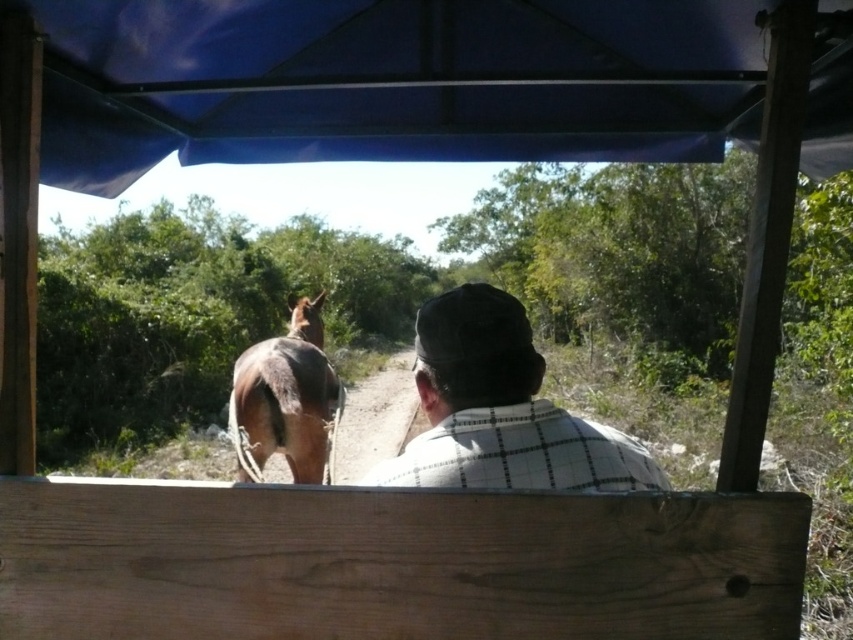
Question: Which point appears farthest from the camera in this image?

Choices:
 (A) (57, 17)
 (B) (283, 394)

Answer: (B)

Question: Which object is the closest to the brown glossy horse at center?

Choices:
 (A) white checkered shirt at center
 (B) blue fabric canopy at upper center

Answer: (B)

Question: Considering the relative positions of blue fabric canopy at upper center and white checkered shirt at center in the image provided, where is blue fabric canopy at upper center located with respect to white checkered shirt at center?

Choices:
 (A) below
 (B) above

Answer: (B)

Question: Considering the relative positions of white checkered shirt at center and brown glossy horse at center in the image provided, where is white checkered shirt at center located with respect to brown glossy horse at center?

Choices:
 (A) left
 (B) right

Answer: (B)

Question: Which object is closer to the camera taking this photo?

Choices:
 (A) blue fabric canopy at upper center
 (B) white checkered shirt at center
 (C) brown glossy horse at center

Answer: (B)

Question: From the image, what is the correct spatial relationship of blue fabric canopy at upper center in relation to brown glossy horse at center?

Choices:
 (A) left
 (B) right

Answer: (B)